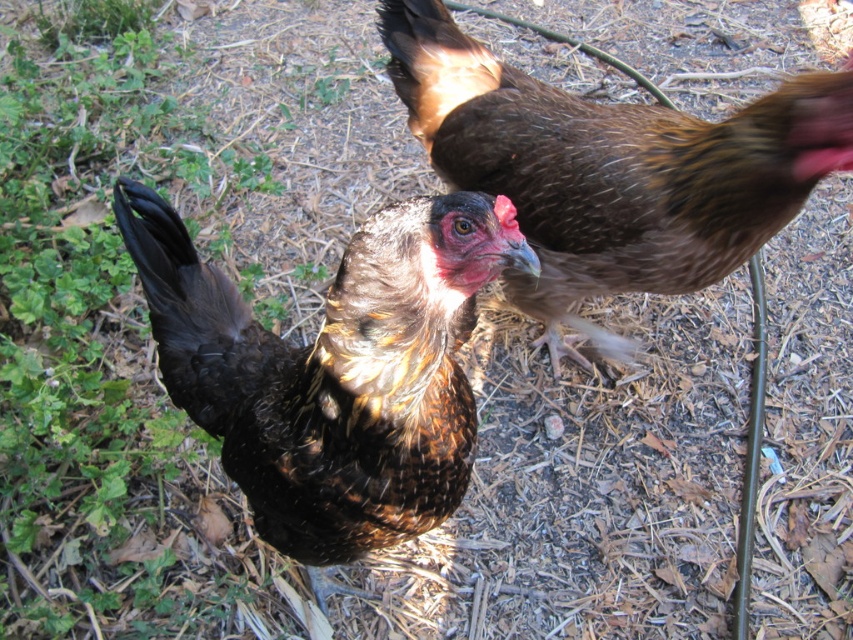
You are standing at the origin point in the image. The brown speckled feathered chicken at center is at coordinates 0.578, 0.393. If you want to walk directly towards it, in which direction should you move?

The brown speckled feathered chicken at center is located at coordinates (334, 369). Since the coordinate system is not specified, but assuming standard image coordinates where the origin is at the bottom left corner, moving towards increasing x and y would mean moving right and up. However, without explicit coordinate details, the safest answer is to state the direction based on the given coordinates. Alternatively, if the origin is top left, then x increases right, y increases down. But since the user

You are standing at the point marked by the coordinates point (334, 369). Looking around, you see a brown speckled feathered chicken at center and another chicken in the background. Which chicken is closer to you?

The point (334, 369) is on the brown speckled feathered chicken at center, so this chicken is closer to you than the other chicken in the background.

You are standing in the field with the two chickens. You want to place a small treat exactly at point (199,362). If your hand is currently at 4 feet from the ground, will you need to reach up or down to place the treat?

The distance of point (199,362) from camera is 4.62 feet. Since your hand is at 4 feet from the ground, you will need to reach up to place the treat at point (199,362) as it is higher than your current hand position.